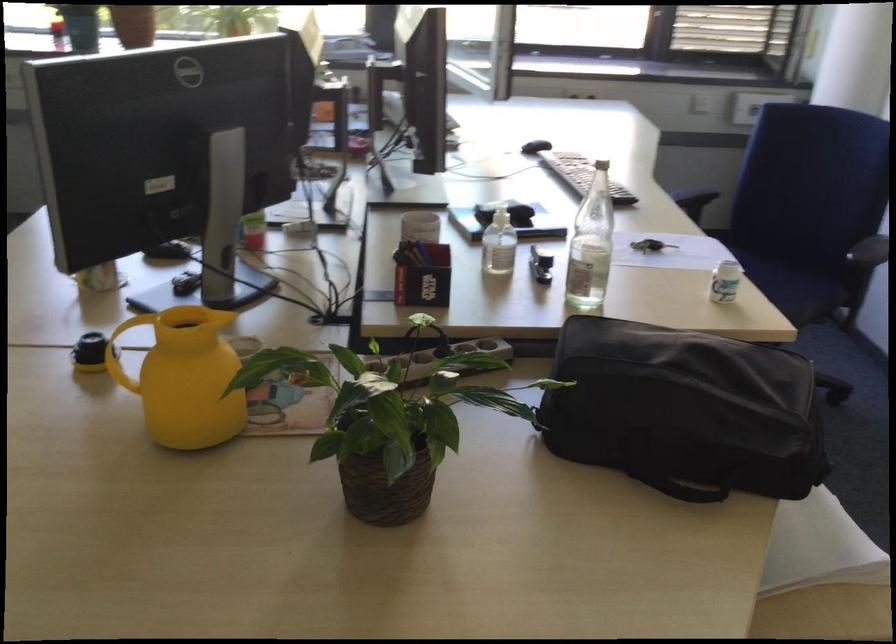
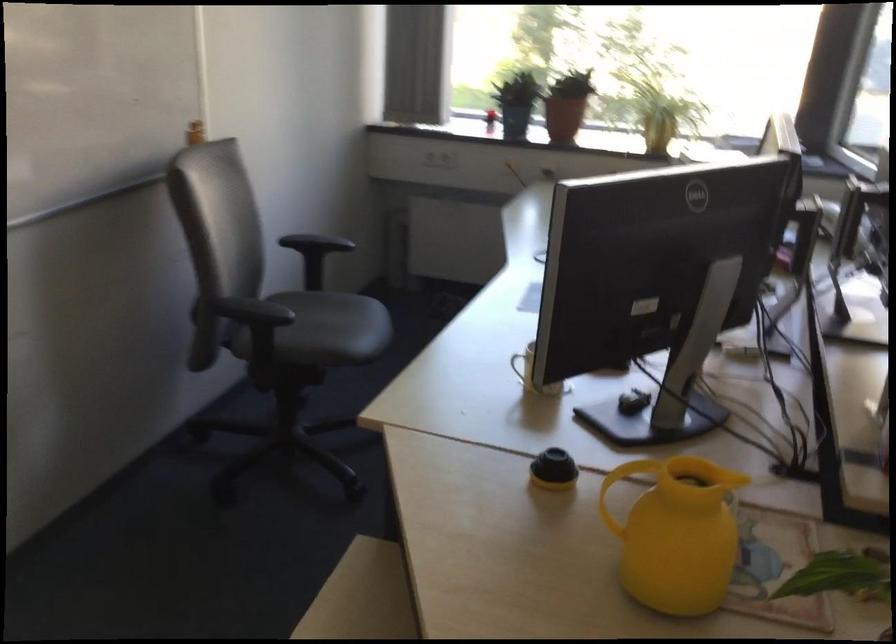
Question: The images are taken continuously from a first-person perspective. In which direction are you moving?

Choices:
 (A) Left
 (B) Right
 (C) Forward
 (D) Backward

Answer: (A)